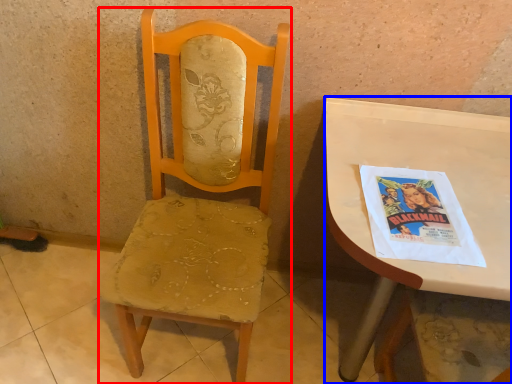
Question: Which point is closer to the camera, chair (highlighted by a red box) or desk (highlighted by a blue box)?

Choices:
 (A) chair
 (B) desk

Answer: (A)